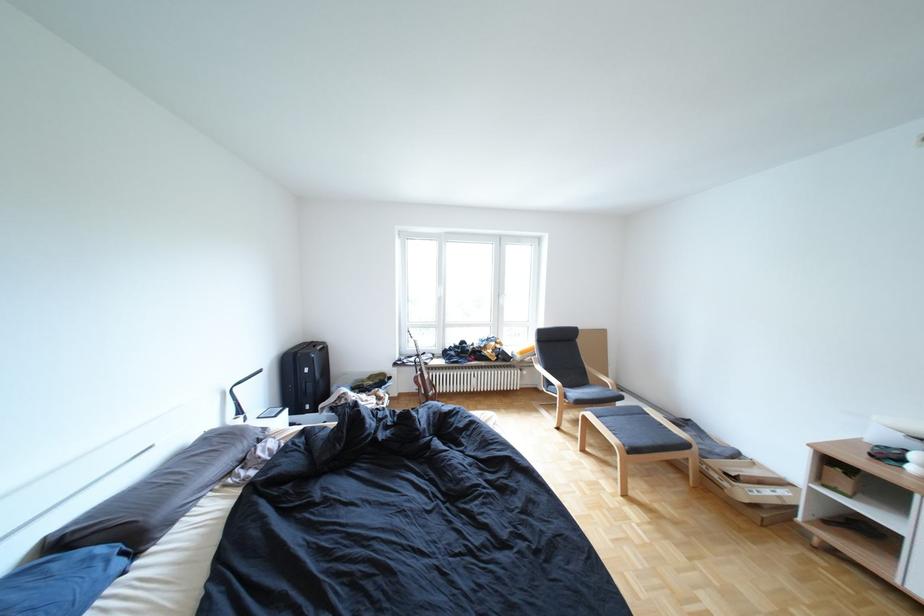
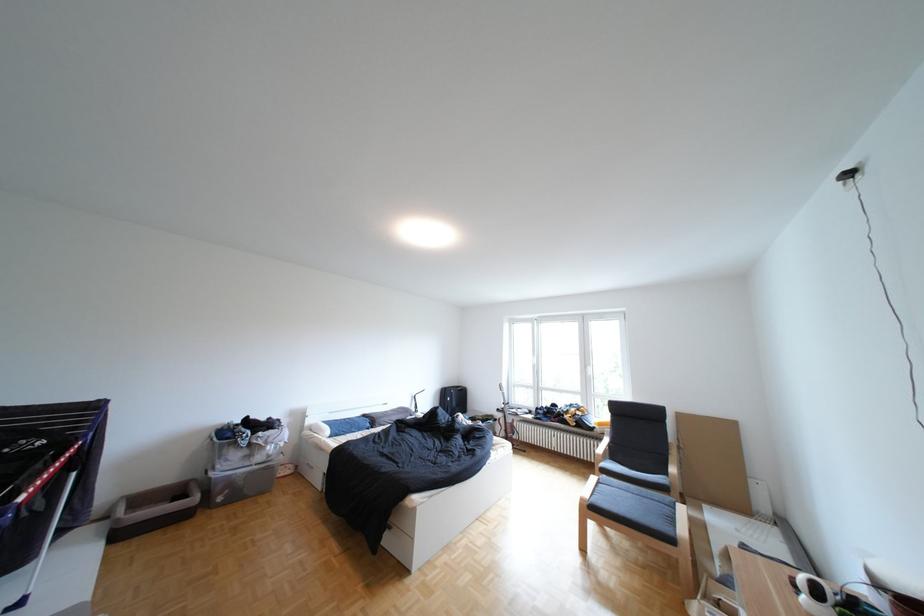
Where in the second image is the point corresponding to [396,381] from the first image?

(502, 419)